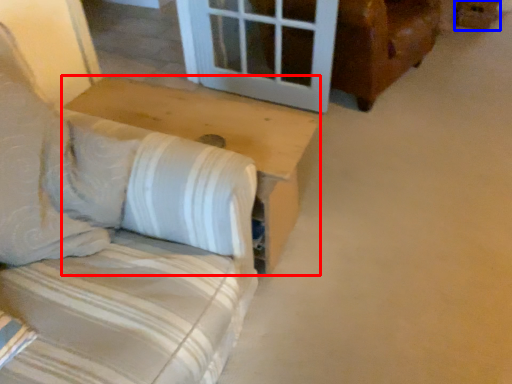
Question: Which object appears closest to the camera in this image, table (highlighted by a red box) or cardboard box (highlighted by a blue box)?

Choices:
 (A) table
 (B) cardboard box

Answer: (A)